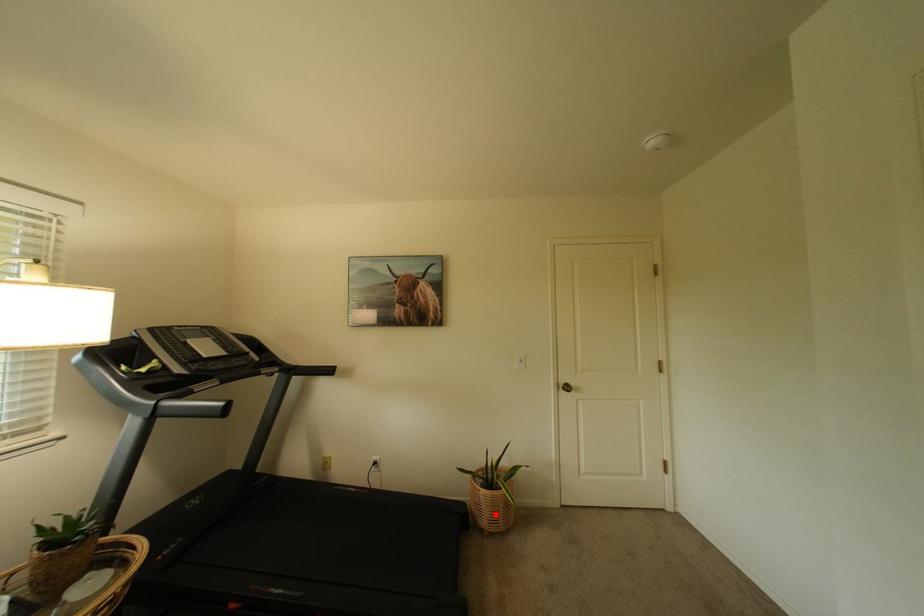
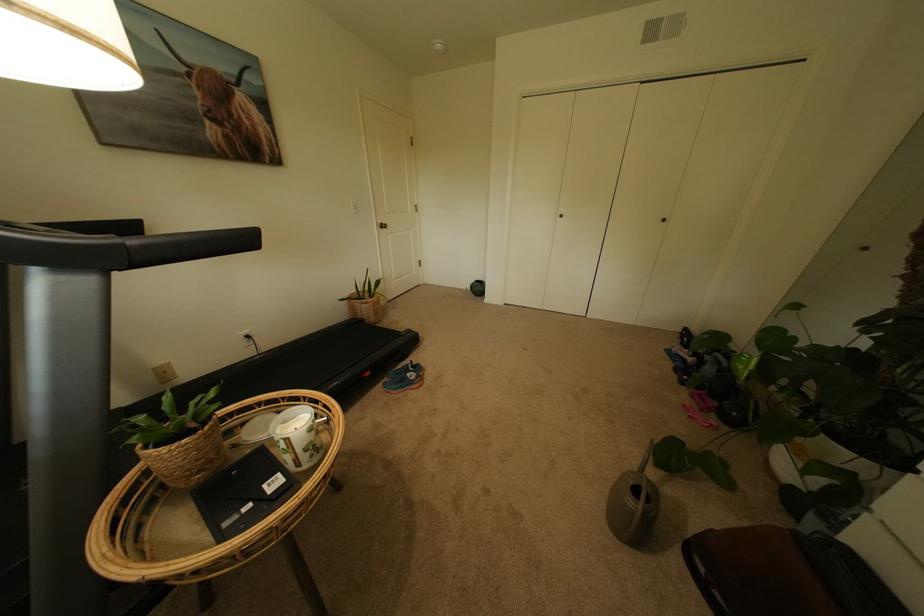
Question: I am providing you with two images of the same scene from different viewpoints. Image1 has a red point marked. In image2, the corresponding 3D location appears at what relative position? Reply with the corresponding letter.

Choices:
 (A) Closer
 (B) Farther

Answer: (A)